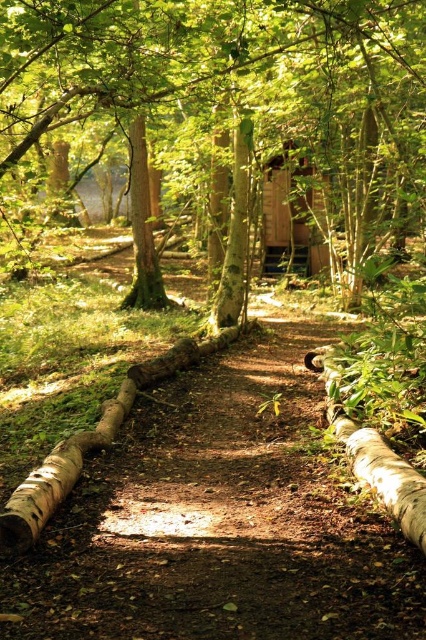
In the scene shown: Does brown dirt path at center have a greater width compared to wooden cabin at center?

No, brown dirt path at center is not wider than wooden cabin at center.

The width and height of the screenshot is (426, 640). I want to click on brown dirt path at center, so click(x=218, y=522).

Locate an element on the screen. The height and width of the screenshot is (640, 426). brown dirt path at center is located at coordinates (218, 522).

Who is more forward, (x=58, y=20) or (x=293, y=241)?

Positioned in front is point (x=58, y=20).

Identify the location of green mossy tree at center. The width and height of the screenshot is (426, 640). (230, 70).

Does brown dirt path at center have a lesser width compared to smooth brown tree trunk at center?

In fact, brown dirt path at center might be wider than smooth brown tree trunk at center.

Is brown dirt path at center to the right of smooth brown tree trunk at center from the viewer's perspective?

Incorrect, brown dirt path at center is not on the right side of smooth brown tree trunk at center.

Does point (210, 513) lie behind point (219, 300)?

That is False.

In order to click on brown dirt path at center in this screenshot , I will do `click(218, 522)`.